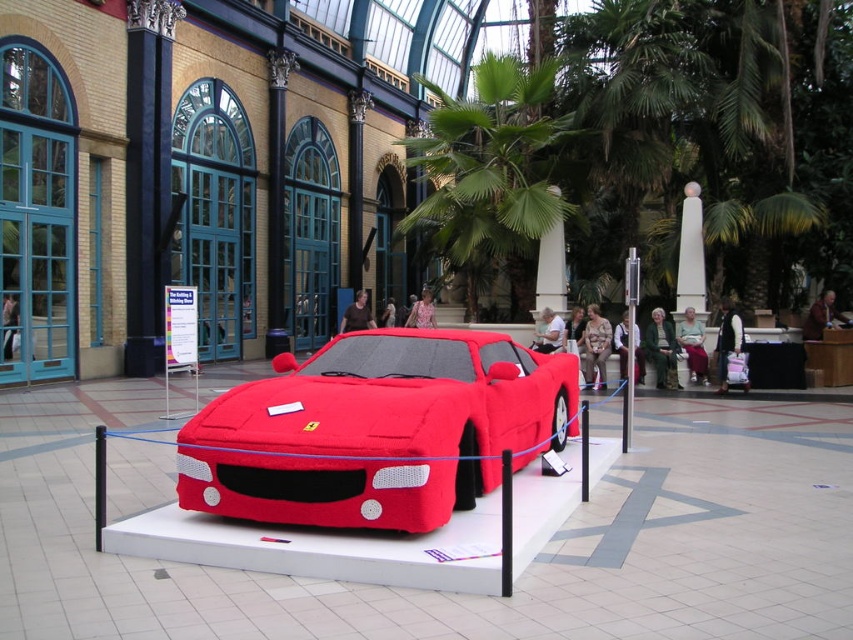
You are an event planner setting up a photo booth. You need to decide where to place the photo booth so that it doesn t block the view of both the matte fabric sports car at center and the green leafy palm tree at upper center. Given their sizes, which object might require more space between the photo booth and itself to ensure visibility?

The green leafy palm tree at upper center requires more space between the photo booth and itself because it has a greater width than the matte fabric sports car at center, as stated in the description.

You are standing at the entrance of the conservatory and want to locate the matte fabric sports car at center. According to the coordinates provided, in which direction should you move relative to your current position to find it?

The matte fabric sports car at center is located at coordinates point (376, 429), so you should move towards the right and slightly forward from your current position at the entrance to reach it.

You are an event planner setting up a photo shoot in the conservatory. You need to position a camera so that both the matte fabric sports car at center and the green leafy palm tree at upper center are in the frame. Considering their heights, which object will appear taller in the photo?

The green leafy palm tree at upper center will appear taller in the photo because it has a greater height than the matte fabric sports car at center.